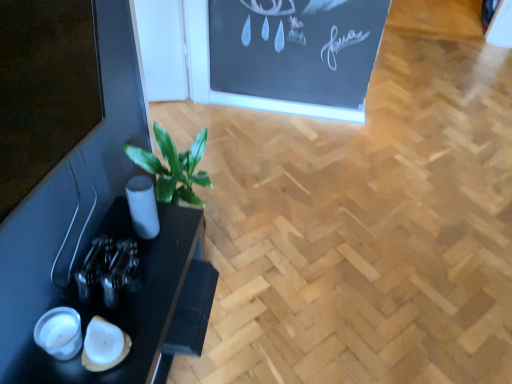
The image size is (512, 384). What do you see at coordinates (109, 270) in the screenshot?
I see `metallic glass bottle at left` at bounding box center [109, 270].

Image resolution: width=512 pixels, height=384 pixels. Find the location of `metallic glass bottle at left`. metallic glass bottle at left is located at coordinates (109, 270).

The image size is (512, 384). Describe the element at coordinates (123, 310) in the screenshot. I see `black glossy table at lower left` at that location.

In order to click on black glossy table at lower left in this screenshot , I will do `click(123, 310)`.

Identify the location of metallic glass bottle at left. The height and width of the screenshot is (384, 512). (109, 270).

Which object is positioned more to the left, black glossy table at lower left or metallic glass bottle at left?

From the viewer's perspective, black glossy table at lower left appears more on the left side.

Which is behind, black glossy table at lower left or metallic glass bottle at left?

metallic glass bottle at left is behind.

Between point (18, 376) and point (83, 288), which one is positioned in front?

The point (18, 376) is in front.

From the image's perspective, does black glossy table at lower left appear lower than metallic glass bottle at left?

Correct, black glossy table at lower left appears lower than metallic glass bottle at left in the image.

From a real-world perspective, between black glossy table at lower left and metallic glass bottle at left, who is vertically lower?

From a 3D spatial view, black glossy table at lower left is below.

In terms of width, does black glossy table at lower left look wider or thinner when compared to metallic glass bottle at left?

black glossy table at lower left is wider than metallic glass bottle at left.

Considering the relative sizes of black glossy table at lower left and metallic glass bottle at left in the image provided, is black glossy table at lower left shorter than metallic glass bottle at left?

Incorrect, the height of black glossy table at lower left does not fall short of that of metallic glass bottle at left.

Considering the sizes of objects black glossy table at lower left and metallic glass bottle at left in the image provided, who is bigger, black glossy table at lower left or metallic glass bottle at left?

black glossy table at lower left is bigger.

Is black glossy table at lower left not inside metallic glass bottle at left?

black glossy table at lower left is positioned outside metallic glass bottle at left.

Is black glossy table at lower left touching metallic glass bottle at left?

No, black glossy table at lower left is not next to metallic glass bottle at left.

Is metallic glass bottle at left at the back of black glossy table at lower left?

black glossy table at lower left is not turned away from metallic glass bottle at left.

How different are the orientations of black glossy table at lower left and metallic glass bottle at left in degrees?

There is a 0.0812-degree angle between the facing directions of black glossy table at lower left and metallic glass bottle at left.

Looking at this image, how distant is black glossy table at lower left from metallic glass bottle at left?

black glossy table at lower left and metallic glass bottle at left are 10.06 centimeters apart from each other.

This screenshot has height=384, width=512. Find the location of `bottle on the right of black glossy table at lower left`. bottle on the right of black glossy table at lower left is located at coordinates (109, 270).

Is metallic glass bottle at left to the right of black glossy table at lower left from the viewer's perspective?

Yes, metallic glass bottle at left is to the right of black glossy table at lower left.

Is metallic glass bottle at left positioned behind black glossy table at lower left?

Yes, metallic glass bottle at left is further from the viewer.

Which is nearer, (96,246) or (145,362)?

Point (145,362)

From the image's perspective, who appears lower, metallic glass bottle at left or black glossy table at lower left?

black glossy table at lower left.

Looking at this image, from a real-world perspective, which is physically above, metallic glass bottle at left or black glossy table at lower left?

From a 3D spatial view, metallic glass bottle at left is above.

Which object is wider, metallic glass bottle at left or black glossy table at lower left?

With larger width is black glossy table at lower left.

Can you confirm if metallic glass bottle at left is shorter than black glossy table at lower left?

Correct, metallic glass bottle at left is not as tall as black glossy table at lower left.

Considering the sizes of metallic glass bottle at left and black glossy table at lower left in the image, is metallic glass bottle at left bigger or smaller than black glossy table at lower left?

Clearly, metallic glass bottle at left is smaller in size than black glossy table at lower left.

Does metallic glass bottle at left contain black glossy table at lower left?

No.

Would you say metallic glass bottle at left is a long distance from black glossy table at lower left?

No, metallic glass bottle at left is not far from black glossy table at lower left.

Is metallic glass bottle at left facing towards black glossy table at lower left?

No.

Based on the photo, how different are the orientations of metallic glass bottle at left and black glossy table at lower left in degrees?

0.0812 degrees separate the facing orientations of metallic glass bottle at left and black glossy table at lower left.

Find the location of `bottle behind the black glossy table at lower left`. bottle behind the black glossy table at lower left is located at coordinates (109, 270).

Locate an element on the screen. This screenshot has height=384, width=512. table on the left of metallic glass bottle at left is located at coordinates (123, 310).

Locate an element on the screen. This screenshot has width=512, height=384. bottle on the right of black glossy table at lower left is located at coordinates point(109,270).